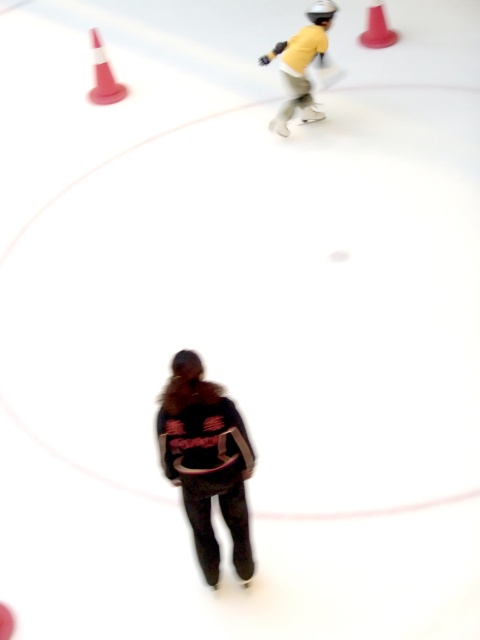
Does point (325, 38) come in front of point (95, 65)?

Yes, it is in front of point (95, 65).

This screenshot has height=640, width=480. Identify the location of yellow matte skateboard at upper center. (301, 65).

Between point (300, 49) and point (96, 90), which one is positioned behind?

Positioned behind is point (96, 90).

Where is `yellow matte skateboard at upper center`? The image size is (480, 640). yellow matte skateboard at upper center is located at coordinates (301, 65).

Does dark brown leather jacket at center lie behind yellow matte skateboard at upper center?

No, it is in front of yellow matte skateboard at upper center.

Does point (242, 451) come farther from viewer compared to point (314, 12)?

No, (242, 451) is in front of (314, 12).

Which is behind, point (180, 410) or point (310, 44)?

Positioned behind is point (310, 44).

The image size is (480, 640). Identify the location of dark brown leather jacket at center. (206, 461).

Who is positioned more to the right, dark brown leather jacket at center or orange plastic cone at upper left?

dark brown leather jacket at center

Which is in front, point (197, 449) or point (98, 88)?

Point (197, 449)

Measure the distance between point (239,525) and camera.

Point (239,525) and camera are 3.62 meters apart.

Find the location of a particular element. dark brown leather jacket at center is located at coordinates (206, 461).